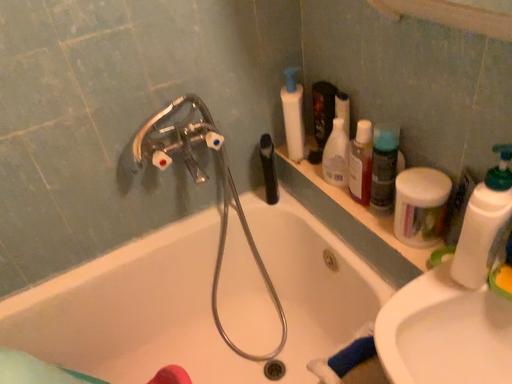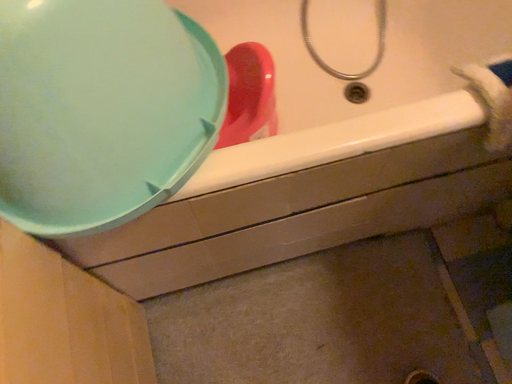
Question: Which way did the camera rotate in the video?

Choices:
 (A) rotated downward
 (B) rotated upward

Answer: (A)